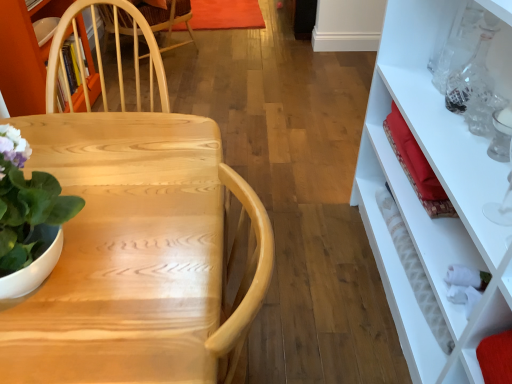
Question: Can you confirm if green matte plant at left is thinner than white textured bottle at right, arranged as the 2th bottle when viewed from the right?

Choices:
 (A) no
 (B) yes

Answer: (A)

Question: Is white textured bottle at right, arranged as the 2th bottle when viewed from the right, located within green matte plant at left?

Choices:
 (A) no
 (B) yes

Answer: (A)

Question: Is green matte plant at left wider than white textured bottle at right, arranged as the 2th bottle when viewed from the right?

Choices:
 (A) no
 (B) yes

Answer: (B)

Question: From a real-world perspective, is green matte plant at left below white textured bottle at right, which appears as the first bottle when ordered from the bottom?

Choices:
 (A) yes
 (B) no

Answer: (B)

Question: Is green matte plant at left aimed at white textured bottle at right, arranged as the 2th bottle when viewed from the right?

Choices:
 (A) no
 (B) yes

Answer: (A)

Question: In the image, is transparent glass bottle at upper right, which is the first bottle in right-to-left order, positioned in front of or behind green matte plant at left?

Choices:
 (A) front
 (B) behind

Answer: (B)

Question: From a real-world perspective, is transparent glass bottle at upper right, which is the first bottle in right-to-left order, physically located above or below green matte plant at left?

Choices:
 (A) below
 (B) above

Answer: (A)

Question: Is transparent glass bottle at upper right, which is the first bottle in right-to-left order, wider or thinner than green matte plant at left?

Choices:
 (A) wide
 (B) thin

Answer: (B)

Question: Visually, is transparent glass bottle at upper right, the 1th bottle positioned from the top, positioned to the left or to the right of green matte plant at left?

Choices:
 (A) left
 (B) right

Answer: (B)

Question: Does point coord(15,210) appear closer or farther from the camera than point coord(430,301)?

Choices:
 (A) closer
 (B) farther

Answer: (A)

Question: In terms of size, does green matte plant at left appear bigger or smaller than white textured bottle at right, the second bottle positioned from the top?

Choices:
 (A) small
 (B) big

Answer: (B)

Question: Is green matte plant at left situated inside white textured bottle at right, which appears as the first bottle when ordered from the bottom, or outside?

Choices:
 (A) outside
 (B) inside

Answer: (A)

Question: From the image's perspective, is green matte plant at left located above or below white textured bottle at right, the second bottle positioned from the top?

Choices:
 (A) below
 (B) above

Answer: (B)

Question: From the image's perspective, is white textured bottle at right, arranged as the 2th bottle when viewed from the right, above or below green matte plant at left?

Choices:
 (A) above
 (B) below

Answer: (B)

Question: Is white textured bottle at right, the 1th bottle in the left-to-right sequence, inside or outside of green matte plant at left?

Choices:
 (A) inside
 (B) outside

Answer: (B)